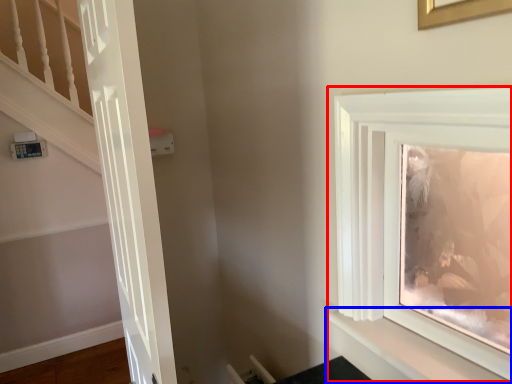
Question: Among these objects, which one is farthest to the camera, window (highlighted by a red box) or shelf (highlighted by a blue box)?

Choices:
 (A) window
 (B) shelf

Answer: (B)